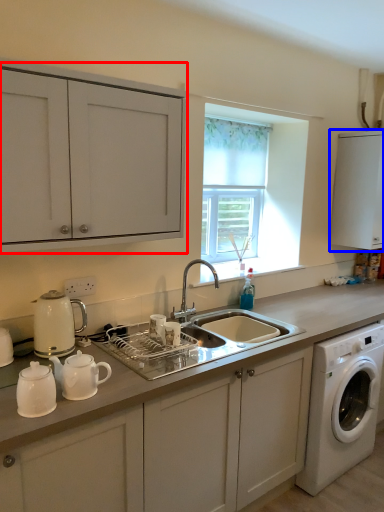
Question: Which of the following is the farthest to the observer, cabinetry (highlighted by a red box) or cabinetry (highlighted by a blue box)?

Choices:
 (A) cabinetry
 (B) cabinetry

Answer: (B)